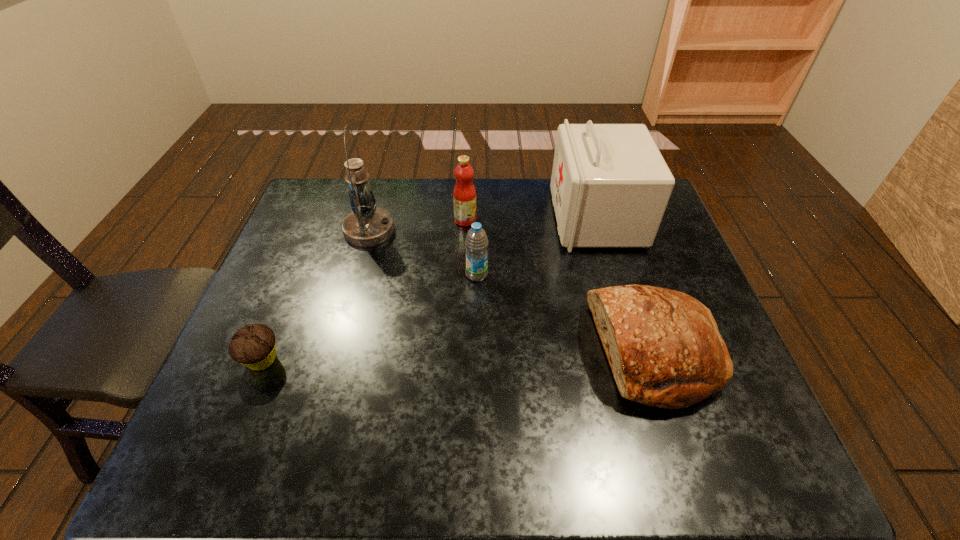
This screenshot has height=540, width=960. I want to click on vacant area located on the front-facing side of the first-aid kit, so click(532, 218).

What are the coordinates of `vacant space located 0.360m on the front label of the third tallest object` in the screenshot? It's located at (591, 220).

Identify the location of vacant space situated 0.290m on the right of the water bottle. This screenshot has height=540, width=960. (593, 275).

Find the location of a particular element. Image resolution: width=960 pixels, height=540 pixels. blank area located at the sliced front of the bread is located at coordinates [543, 352].

Find the location of `free region located at the sliced front of the bread`. free region located at the sliced front of the bread is located at coordinates (428, 352).

Locate an element on the screen. free space located at the sliced front of the bread is located at coordinates (517, 352).

You are a GUI agent. You are given a task and a screenshot of the screen. Output one action in this format:
    pyautogui.click(x=<x>, y=<y>)
    Task: Click on the free region located 0.190m on the back of the leftmost object
    This screenshot has height=540, width=960.
    Given the screenshot: What is the action you would take?
    pyautogui.click(x=293, y=285)

Locate an element on the screen. oil lamp situated at the far edge is located at coordinates (367, 225).

In order to click on the first-aid kit that is at the far edge in this screenshot , I will do 610,186.

The width and height of the screenshot is (960, 540). I want to click on fruit juice present at the far edge, so point(464,194).